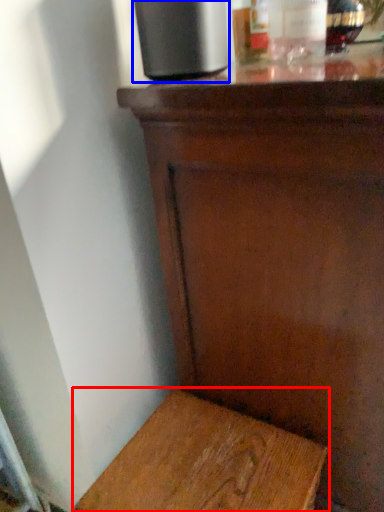
Question: Which object appears farthest to the camera in this image, furniture (highlighted by a red box) or appliance (highlighted by a blue box)?

Choices:
 (A) furniture
 (B) appliance

Answer: (A)